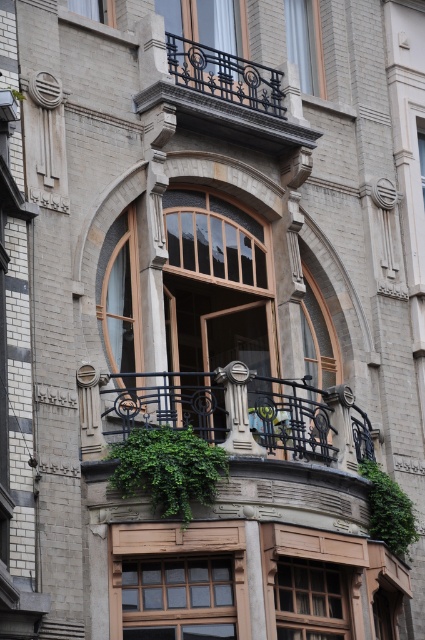
You are a gardener who wants to ensure the green leafy plant at center receives enough sunlight. Given that the clear glass window at center is above it, would the plant get sufficient light through the window?

The green leafy plant at center is positioned under the clear glass window at center, so sunlight can pass through the window and reach the plant, providing it with sufficient light.

You are standing in front of the building and notice the green leafy plant at center and the clear glass window at center. According to the scene, which object is positioned to the right side?

The green leafy plant at center is positioned to the right of the clear glass window at center.